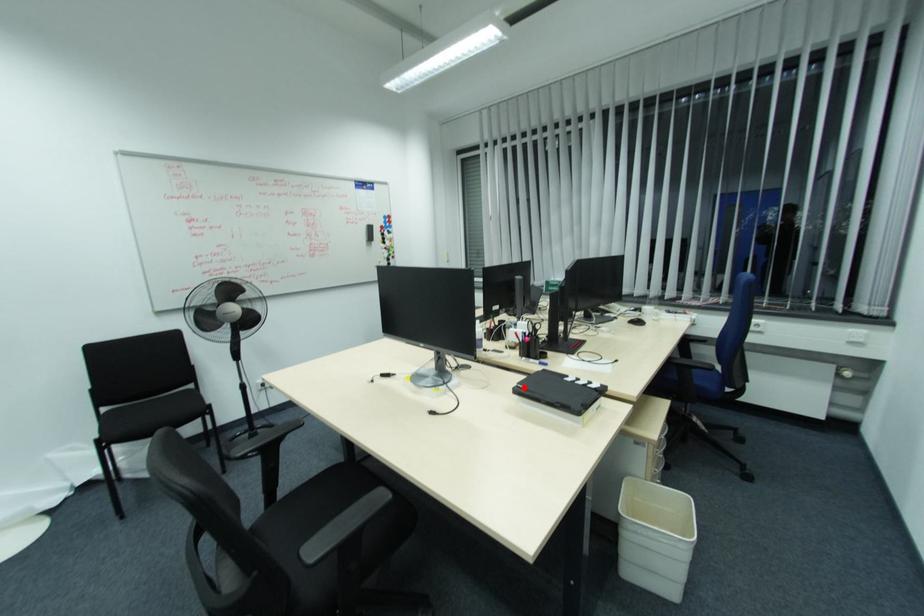
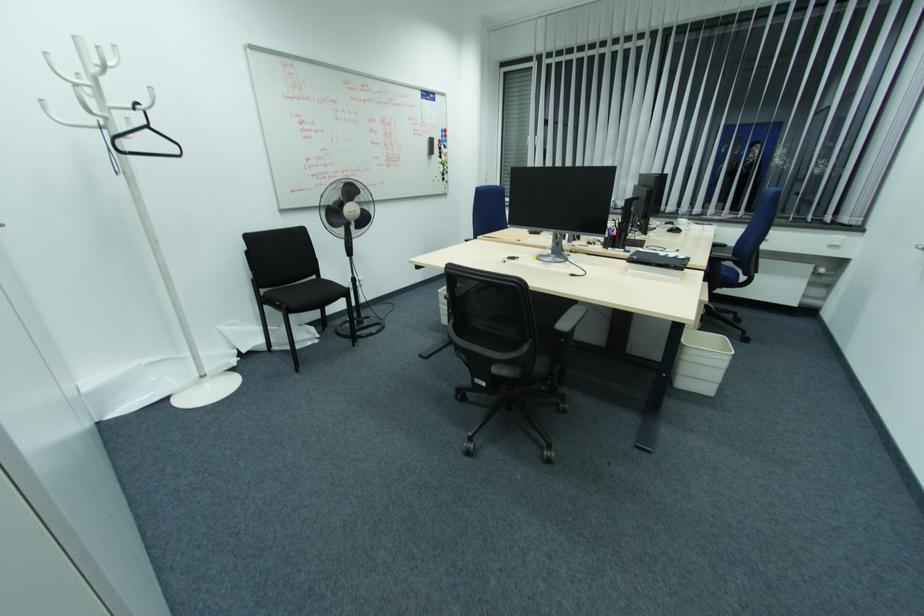
The point at the highlighted location is marked in the first image. Where is the corresponding point in the second image?

(638, 257)